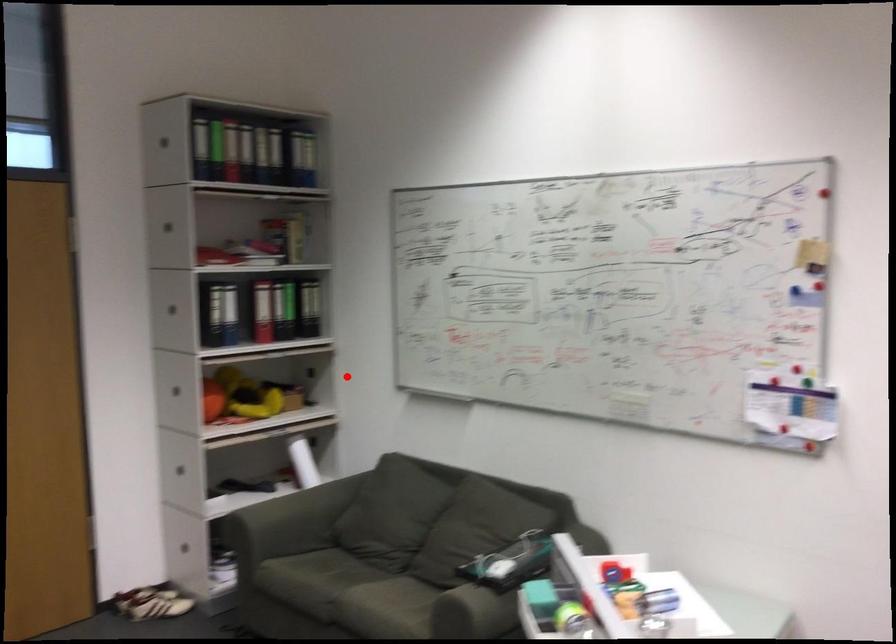
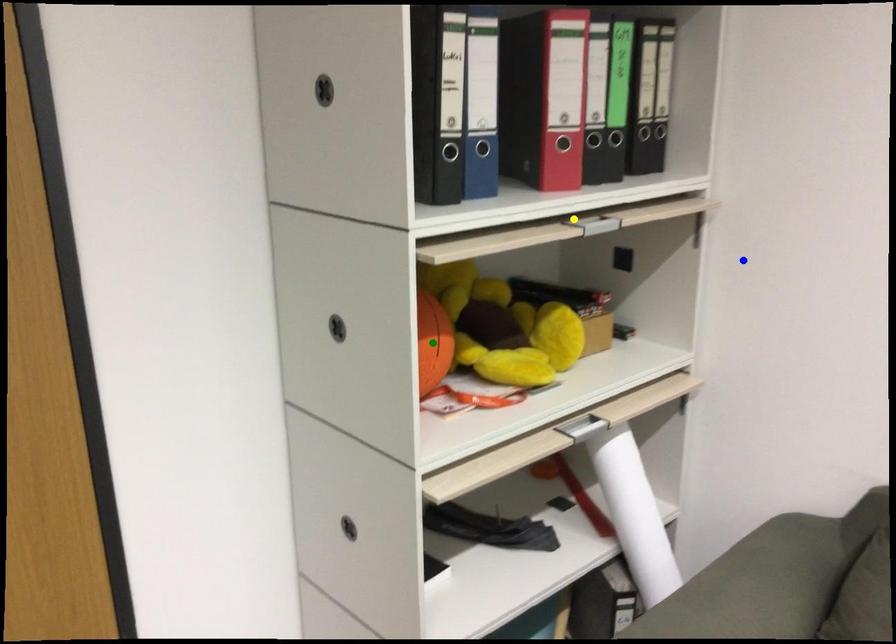
Question: I am providing you with two images of the same scene from different viewpoints. A red point is marked on the first image. You are given multiple points on the second image. Which point in image 2 represents the same 3d spot as the red point in image 1?

Choices:
 (A) blue point
 (B) yellow point
 (C) green point

Answer: (A)